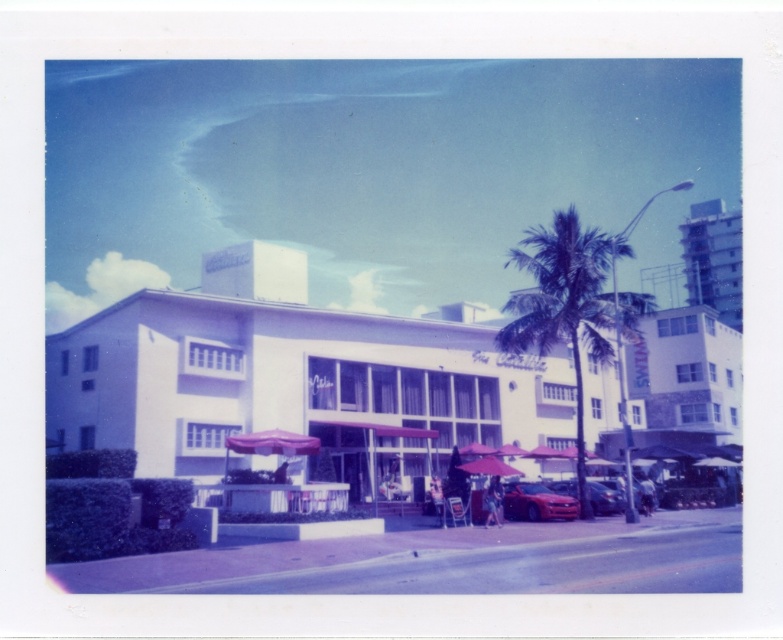
Which is more to the left, green leafy palm tree at center-right or pink fabric umbrella at center?

pink fabric umbrella at center

Is point (520, 253) closer to camera compared to point (240, 442)?

No, (520, 253) is further to viewer.

Locate an element on the screen. The width and height of the screenshot is (783, 640). green leafy palm tree at center-right is located at coordinates (565, 305).

Looking at this image, who is taller, green leafy palm tree at center-right or shiny red sedan at lower right?

green leafy palm tree at center-right is taller.

Can you confirm if green leafy palm tree at center-right is shorter than shiny red sedan at lower right?

Incorrect, green leafy palm tree at center-right's height does not fall short of shiny red sedan at lower right's.

Between point (601, 337) and point (529, 520), which one is positioned behind?

Point (601, 337)

Identify the location of green leafy palm tree at center-right. pyautogui.click(x=565, y=305).

Which of these two, white matte building at center or green leafy palm tree at center-right, stands shorter?

white matte building at center

Between point (419, 406) and point (572, 346), which one is positioned in front?

Point (572, 346) is in front.

Who is more distant from viewer, (x=190, y=400) or (x=558, y=298)?

Point (x=558, y=298)

The image size is (783, 640). Find the location of `white matte building at center`. white matte building at center is located at coordinates (294, 378).